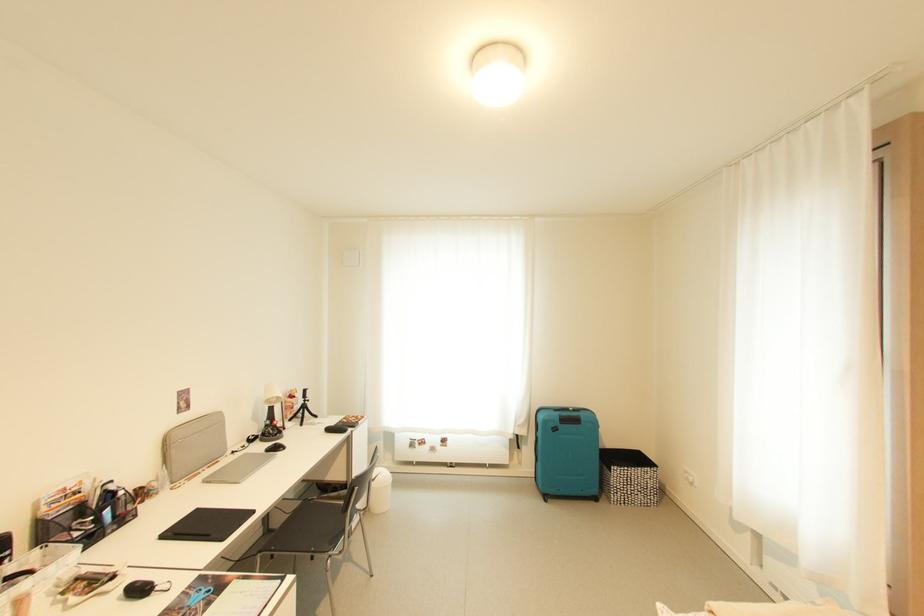
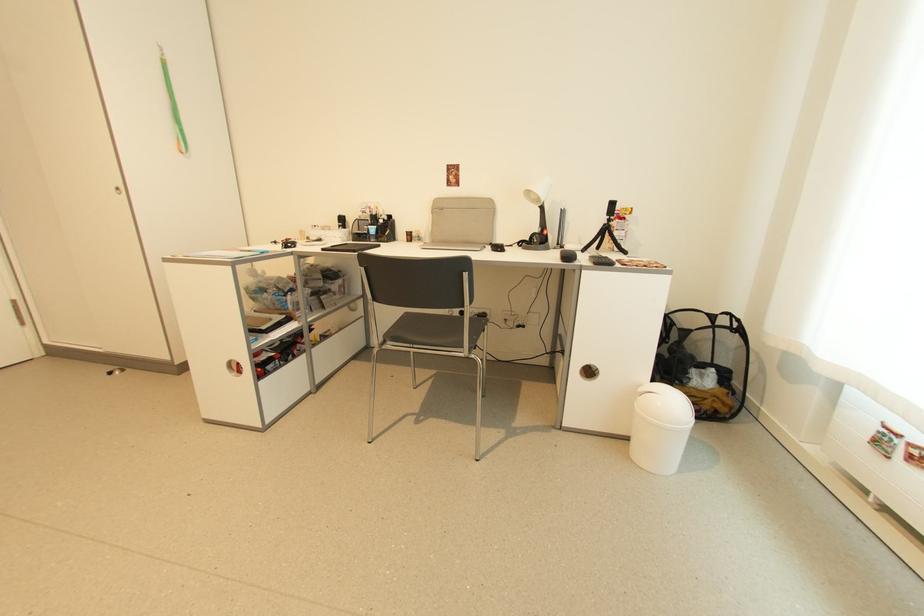
The point at (309, 400) is marked in the first image. Where is the corresponding point in the second image?

(612, 217)